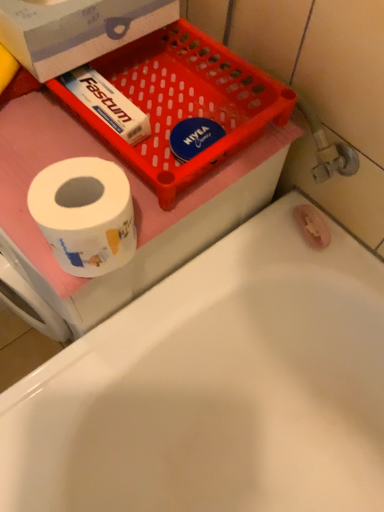
Question: Can you confirm if white glossy toilet paper at left is positioned to the right of white glossy bathtub at lower left?

Choices:
 (A) no
 (B) yes

Answer: (A)

Question: Is white glossy bathtub at lower left completely or partially inside white glossy toilet paper at left?

Choices:
 (A) no
 (B) yes

Answer: (A)

Question: Is white glossy toilet paper at left positioned with its back to white glossy bathtub at lower left?

Choices:
 (A) yes
 (B) no

Answer: (B)

Question: From the image's perspective, does white glossy toilet paper at left appear lower than white glossy bathtub at lower left?

Choices:
 (A) yes
 (B) no

Answer: (B)

Question: Does white glossy toilet paper at left lie in front of white glossy bathtub at lower left?

Choices:
 (A) yes
 (B) no

Answer: (B)

Question: From their relative heights in the image, would you say white glossy toilet paper at left is taller or shorter than white cardboard box at upper left?

Choices:
 (A) short
 (B) tall

Answer: (A)

Question: Which is correct: white glossy toilet paper at left is inside white cardboard box at upper left, or outside of it?

Choices:
 (A) outside
 (B) inside

Answer: (A)

Question: Is white glossy toilet paper at left in front of or behind white cardboard box at upper left in the image?

Choices:
 (A) front
 (B) behind

Answer: (A)

Question: Is white glossy toilet paper at left to the left or to the right of white cardboard box at upper left in the image?

Choices:
 (A) left
 (B) right

Answer: (B)

Question: In terms of width, does white glossy bathtub at lower left look wider or thinner when compared to white glossy toilet paper at left?

Choices:
 (A) thin
 (B) wide

Answer: (B)

Question: Is white glossy bathtub at lower left taller or shorter than white glossy toilet paper at left?

Choices:
 (A) tall
 (B) short

Answer: (A)

Question: Is white glossy bathtub at lower left to the left or to the right of white glossy toilet paper at left in the image?

Choices:
 (A) left
 (B) right

Answer: (B)

Question: Is white glossy bathtub at lower left in front of or behind white glossy toilet paper at left in the image?

Choices:
 (A) behind
 (B) front

Answer: (B)

Question: Is point (195, 31) closer or farther from the camera than point (99, 251)?

Choices:
 (A) farther
 (B) closer

Answer: (A)

Question: Is red plastic tray at upper left situated inside white glossy toilet paper at left or outside?

Choices:
 (A) outside
 (B) inside

Answer: (A)